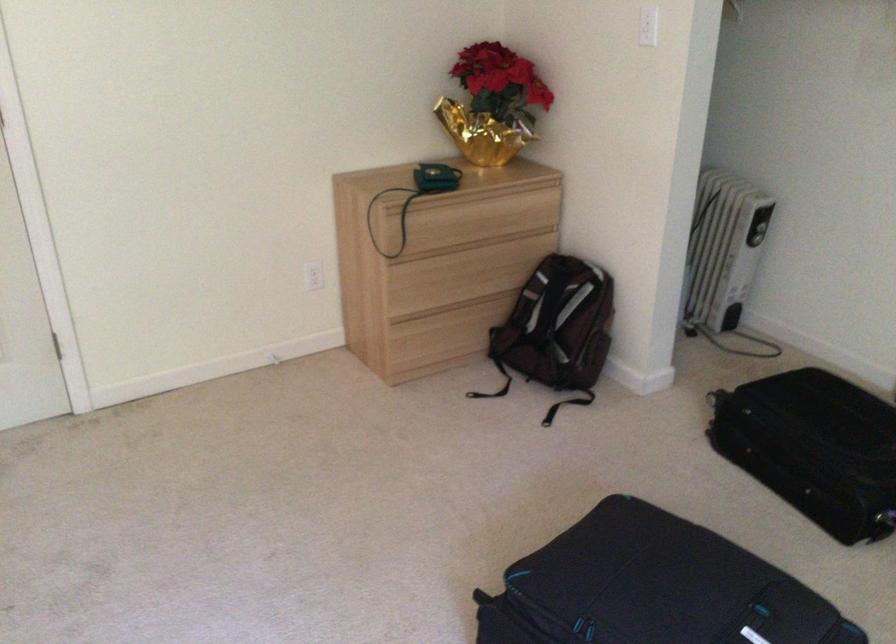
This screenshot has height=644, width=896. What do you see at coordinates (492, 210) in the screenshot?
I see `the top drawer front` at bounding box center [492, 210].